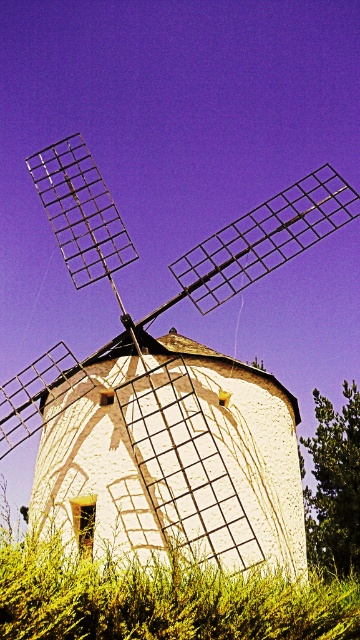
Question: Is the position of white matte windmill at center less distant than that of green leafy grass at lower center?

Choices:
 (A) no
 (B) yes

Answer: (A)

Question: Can you confirm if white matte windmill at center is smaller than green leafy grass at lower center?

Choices:
 (A) no
 (B) yes

Answer: (A)

Question: Does white matte windmill at center have a greater width compared to green leafy grass at lower center?

Choices:
 (A) yes
 (B) no

Answer: (A)

Question: Which of the following is the farthest from the observer?

Choices:
 (A) green leafy grass at lower center
 (B) white matte windmill at center

Answer: (B)

Question: Among these points, which one is farthest from the camera?

Choices:
 (A) (41, 576)
 (B) (187, 401)

Answer: (B)